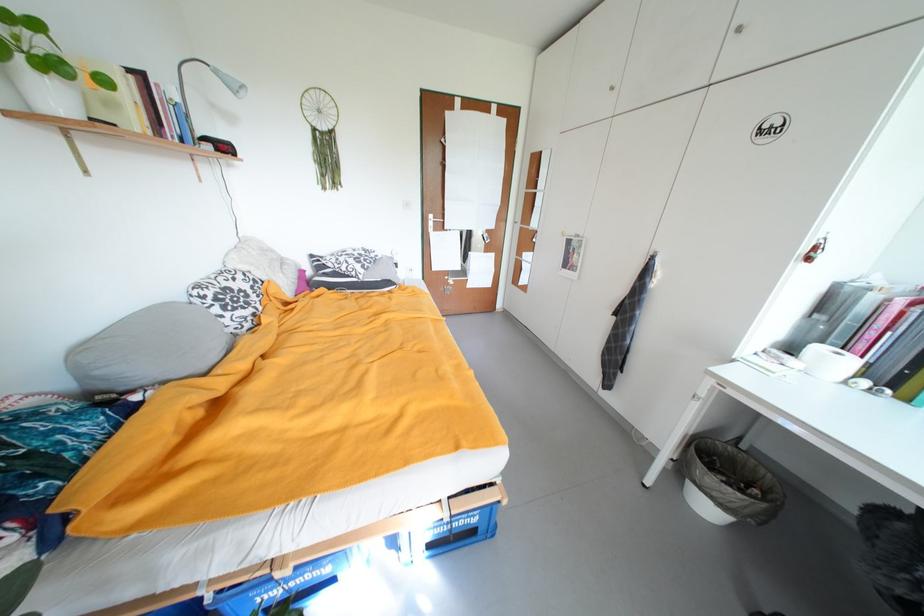
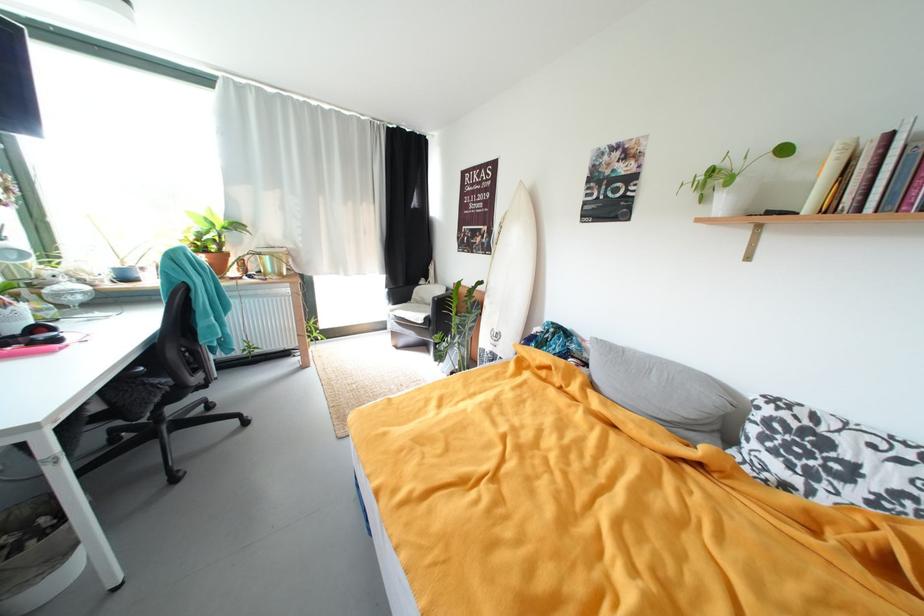
Where in the second image is the point corresponding to [261,299] from the first image?

(861, 493)